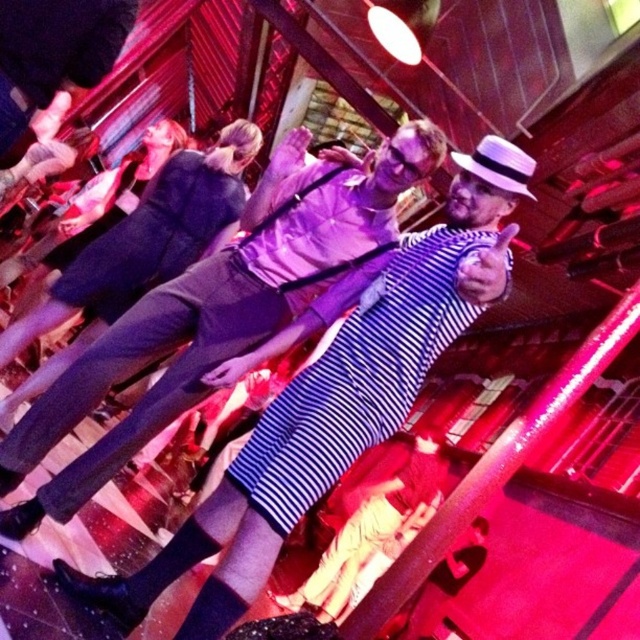
Question: Which object is positioned farthest from the striped fabric dress at center?

Choices:
 (A) matte black dress at center
 (B) striped fabric shirt at center

Answer: (B)

Question: Which point is closer to the camera taking this photo?

Choices:
 (A) (300, 468)
 (B) (131, 248)
 (C) (324, 600)

Answer: (A)

Question: Which of these objects is positioned farthest from the striped fabric dress at center?

Choices:
 (A) striped fabric shirt at center
 (B) matte black dress at center

Answer: (A)

Question: Can you confirm if striped fabric shirt at center is positioned below striped fabric dress at center?

Choices:
 (A) no
 (B) yes

Answer: (A)

Question: Is striped fabric shirt at center thinner than striped fabric dress at center?

Choices:
 (A) yes
 (B) no

Answer: (A)

Question: Does striped fabric shirt at center have a greater width compared to striped fabric dress at center?

Choices:
 (A) yes
 (B) no

Answer: (B)